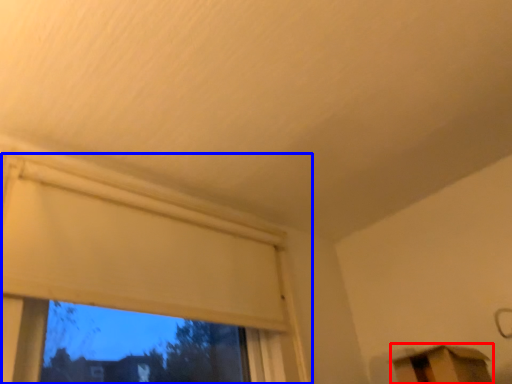
Question: Which of the following is the farthest to the observer, furniture (highlighted by a red box) or window (highlighted by a blue box)?

Choices:
 (A) furniture
 (B) window

Answer: (A)